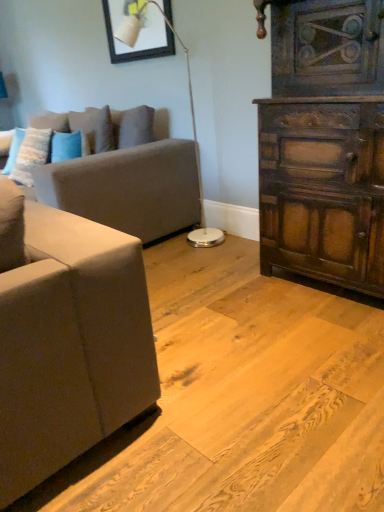
You are a GUI agent. You are given a task and a screenshot of the screen. Output one action in this format:
    pyautogui.click(x=<x>, y=<y>)
    Task: Click on the free space in front of white glossy floor lamp at center
    
    Given the screenshot: What is the action you would take?
    pyautogui.click(x=202, y=268)